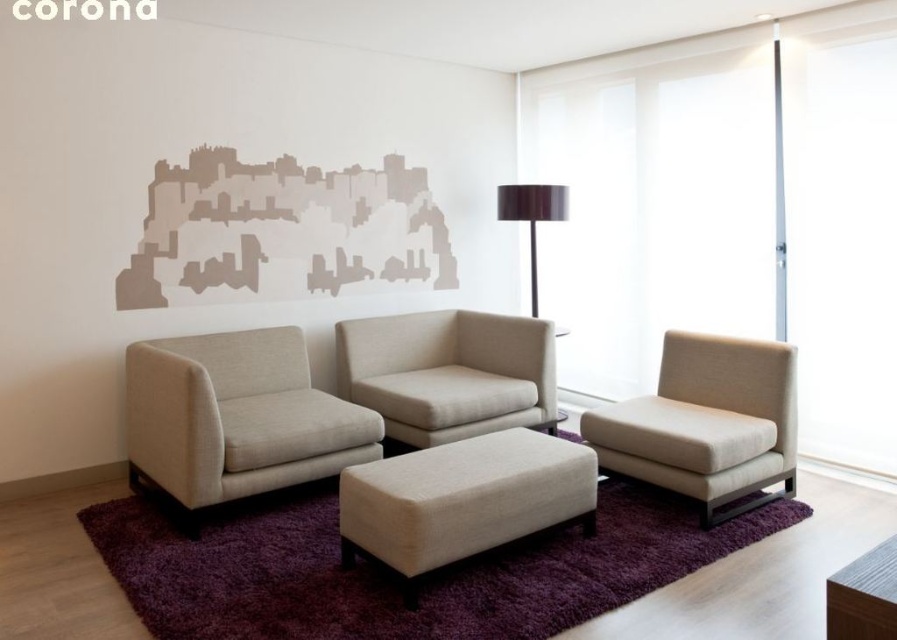
You are sitting in the beige fabric armchair at center and want to reach the shiny dark brown lampshade at upper right. Which direction should you turn your head to look at it?

You should turn your head to the right to look at the shiny dark brown lampshade at upper right because the beige fabric armchair at center is to the left of it.

You are planning to place a 1.2 meter tall potted plant in the living room. Considering the beige fabric ottoman at center and the wooden table at lower right, which object should you place the plant on to ensure it is visible from the entrance?

The beige fabric ottoman at center has a greater height compared to wooden table at lower right, so placing the 1.2 meter tall potted plant on the beige fabric ottoman at center will make it more visible from the entrance.

You are standing in the living room and want to place a small table between the beige fabric armchair at center and the ottoman. Based on their positions, can you estimate whether there is enough space for the table?

The beige fabric armchair at center is positioned at point [234,419], so there is sufficient space between it and the ottoman to place a small table.